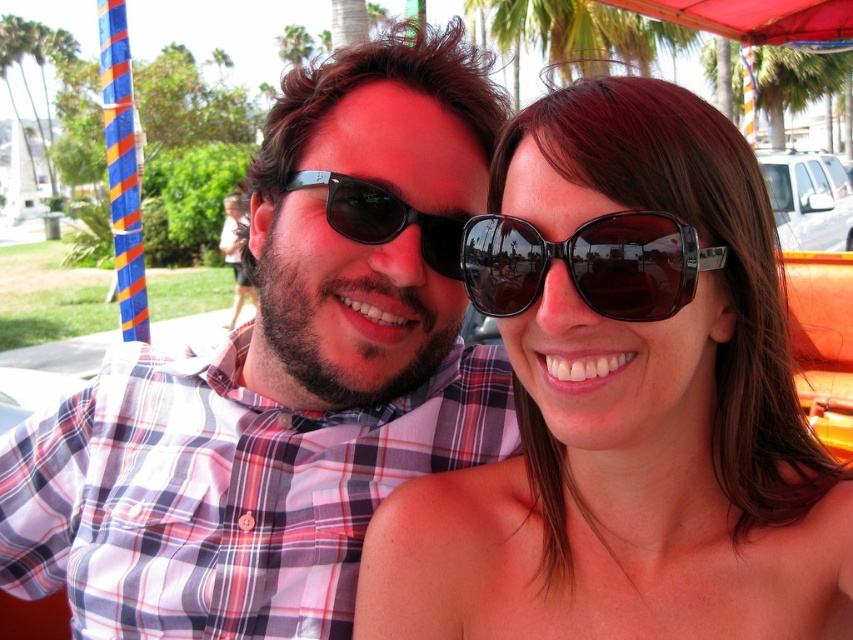
Question: Which object is the closest to the matte black sunglasses at center?

Choices:
 (A) plaid shirt at center
 (B) black plastic sunglasses at center

Answer: (A)

Question: Which point is farther to the camera?

Choices:
 (A) black plastic sunglasses at center
 (B) plaid shirt at center
 (C) black reflective sunglasses at upper center
 (D) matte black sunglasses at center

Answer: (A)

Question: Which point is farther to the camera?

Choices:
 (A) (747, 307)
 (B) (297, 102)

Answer: (B)

Question: Is matte black sunglasses at center closer to the viewer compared to black reflective sunglasses at upper center?

Choices:
 (A) no
 (B) yes

Answer: (A)

Question: Can you confirm if matte black sunglasses at center is positioned to the left of black plastic sunglasses at center?

Choices:
 (A) no
 (B) yes

Answer: (A)

Question: Is matte black sunglasses at center smaller than black plastic sunglasses at center?

Choices:
 (A) no
 (B) yes

Answer: (A)